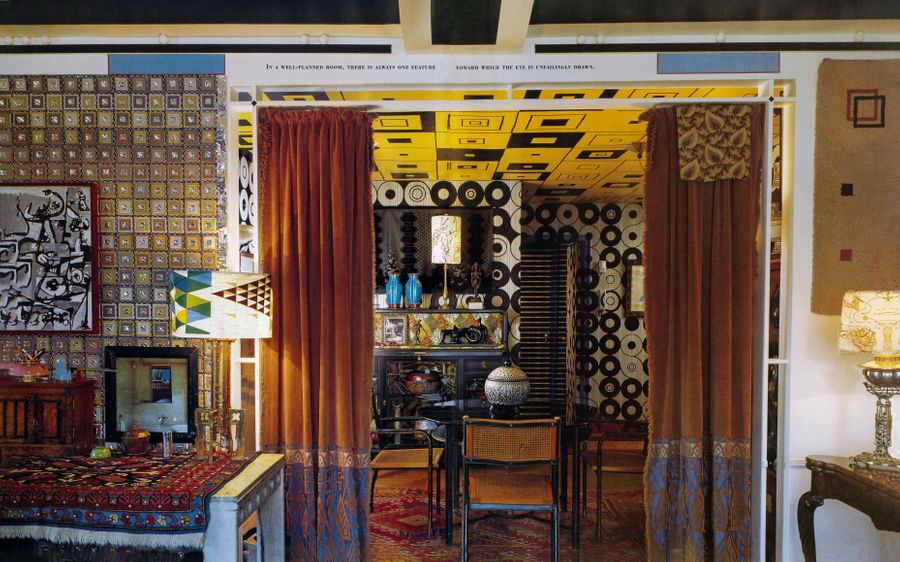
What are the coordinates of `carpet` in the screenshot? It's located at (410, 518), (634, 518).